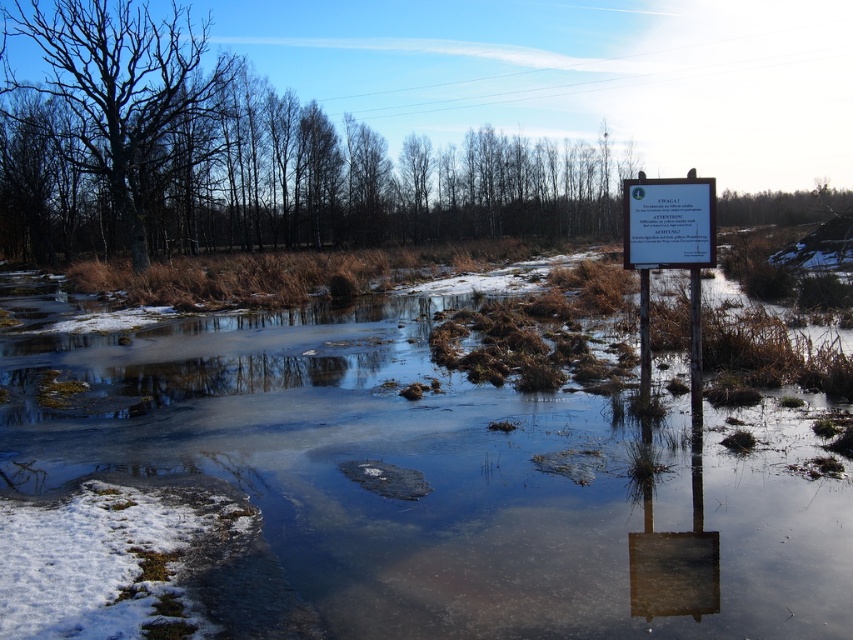
Question: Which object is the farthest from the white plastic sign at center?

Choices:
 (A) white plastic sign at right
 (B) bare wood tree at upper left
 (C) dark brown bark tree at left

Answer: (B)

Question: Is translucent ice at stream right above white plastic sign at center?

Choices:
 (A) yes
 (B) no

Answer: (B)

Question: Which point is farther to the camera?

Choices:
 (A) (141, 205)
 (B) (691, 285)
 (C) (41, 12)
 (D) (781, 220)

Answer: (D)

Question: Is dark brown bark tree at left to the left of white plastic sign at center from the viewer's perspective?

Choices:
 (A) yes
 (B) no

Answer: (A)

Question: Does translucent ice at stream right appear on the left side of white plastic sign at center?

Choices:
 (A) no
 (B) yes

Answer: (B)

Question: Which of the following is the farthest from the observer?

Choices:
 (A) (729, 634)
 (B) (445, 152)
 (C) (685, 260)
 (D) (653, 257)

Answer: (B)